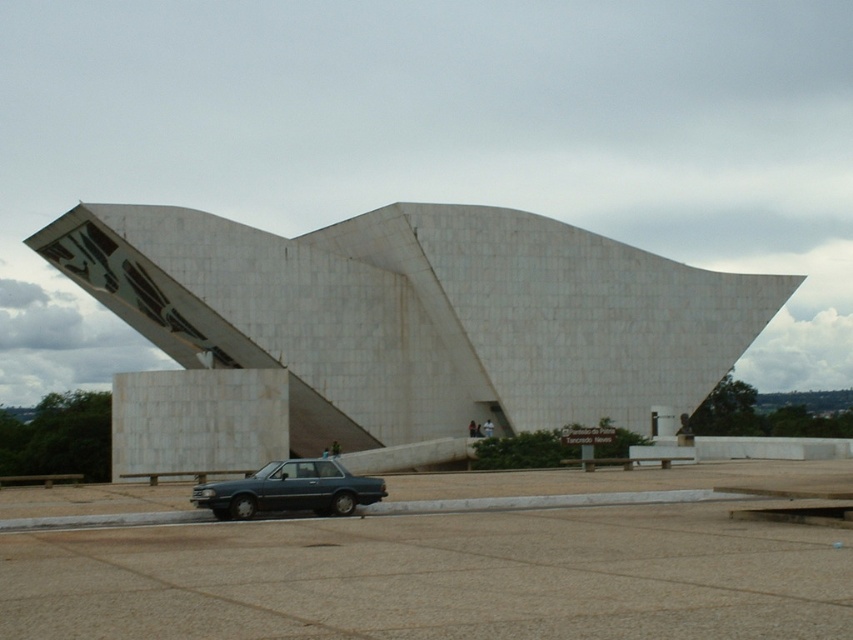
Question: Among these objects, which one is nearest to the camera?

Choices:
 (A) white marble building at center
 (B) matte blue sedan at lower center

Answer: (B)

Question: Among these objects, which one is farthest from the camera?

Choices:
 (A) white marble building at center
 (B) matte blue sedan at lower center

Answer: (A)

Question: Can you confirm if white marble building at center is smaller than matte blue sedan at lower center?

Choices:
 (A) yes
 (B) no

Answer: (B)

Question: Does white marble building at center appear over matte blue sedan at lower center?

Choices:
 (A) yes
 (B) no

Answer: (A)

Question: Is white marble building at center positioned behind matte blue sedan at lower center?

Choices:
 (A) yes
 (B) no

Answer: (A)

Question: Which point is closer to the camera?

Choices:
 (A) (210, 500)
 (B) (328, 328)

Answer: (A)